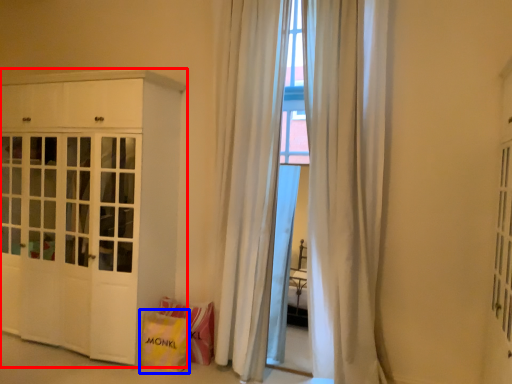
Question: Which object is further to the camera taking this photo, cabinetry (highlighted by a red box) or shopping bag (highlighted by a blue box)?

Choices:
 (A) cabinetry
 (B) shopping bag

Answer: (B)